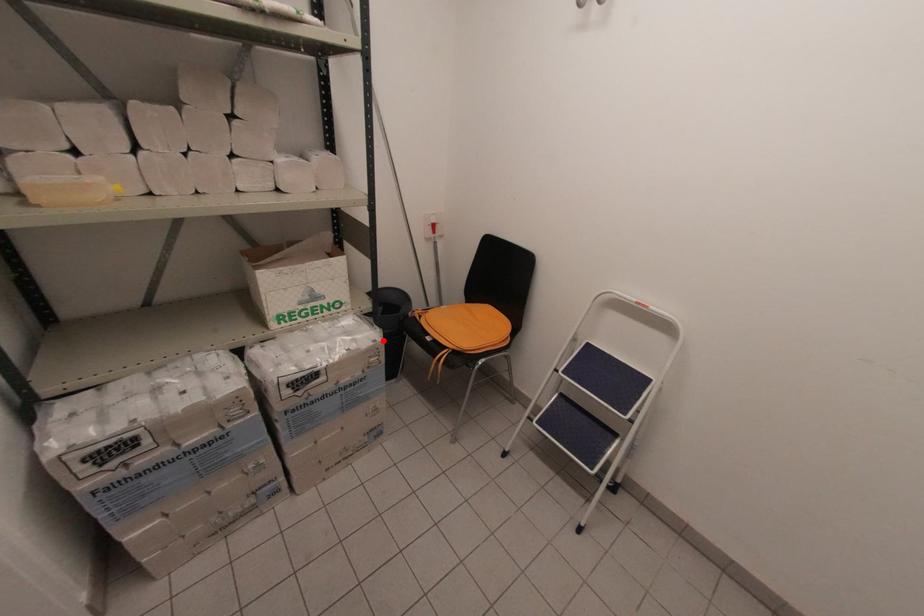
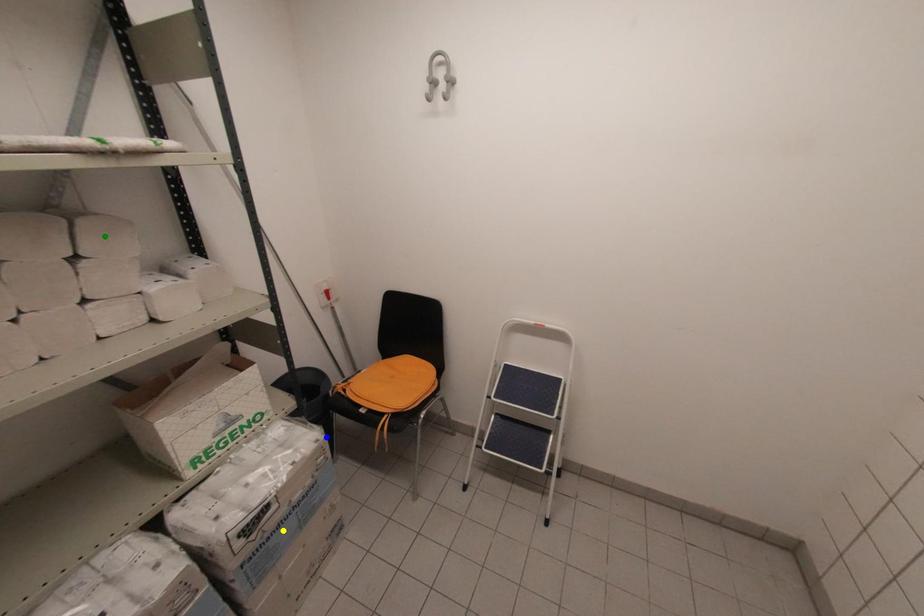
Question: I am providing you with two images of the same scene from different viewpoints. A red point is marked on the first image. You are given multiple points on the second image. Which point in image 2 represents the same 3d spot as the red point in image 1?

Choices:
 (A) green point
 (B) yellow point
 (C) blue point

Answer: (C)